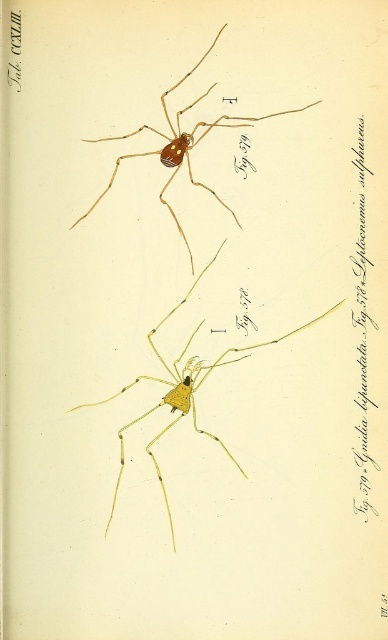
Can you confirm if yellow matte spider at center is positioned to the right of yellow matte spider at upper center?

Correct, you'll find yellow matte spider at center to the right of yellow matte spider at upper center.

Can you confirm if yellow matte spider at center is wider than yellow matte spider at upper center?

Yes.

This screenshot has height=640, width=388. I want to click on yellow matte spider at center, so click(185, 388).